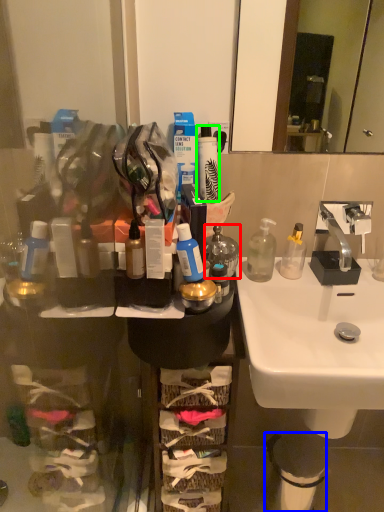
Question: Which object is the farthest from bottle (highlighted by a red box)? Choose among these: trash bin/can (highlighted by a blue box) or toiletry (highlighted by a green box).

Choices:
 (A) trash bin/can
 (B) toiletry

Answer: (A)